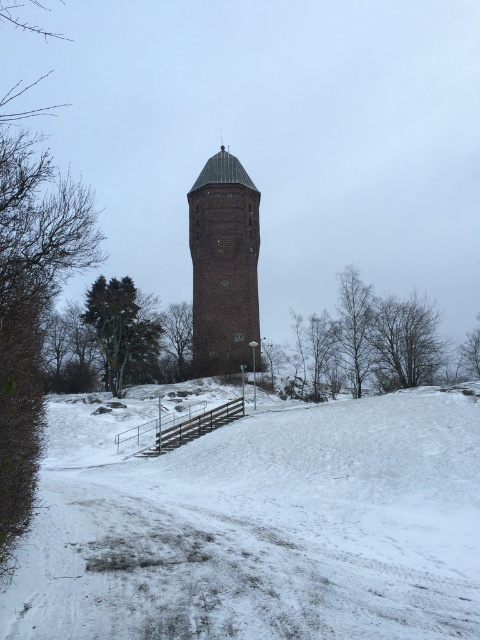
Who is lower down, snowy grass at lower left or brown brick tower at center?

snowy grass at lower left is lower down.

Which is more to the right, snowy grass at lower left or brown brick tower at center?

snowy grass at lower left is more to the right.

Locate an element on the screen. The image size is (480, 640). snowy grass at lower left is located at coordinates (257, 525).

Locate an element on the screen. The image size is (480, 640). snowy grass at lower left is located at coordinates (257, 525).